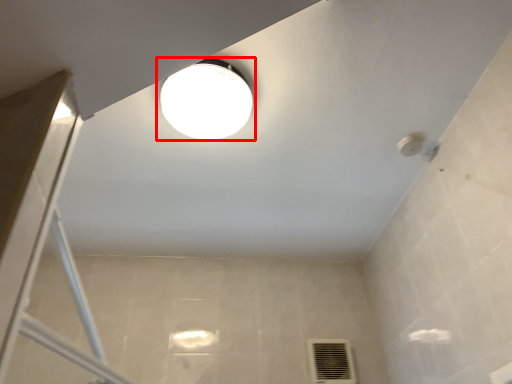
Question: From the image's perspective, considering the relative positions of lamp (annotated by the red box) and air conditioning in the image provided, where is lamp (annotated by the red box) located with respect to the staircase?

Choices:
 (A) above
 (B) below

Answer: (A)